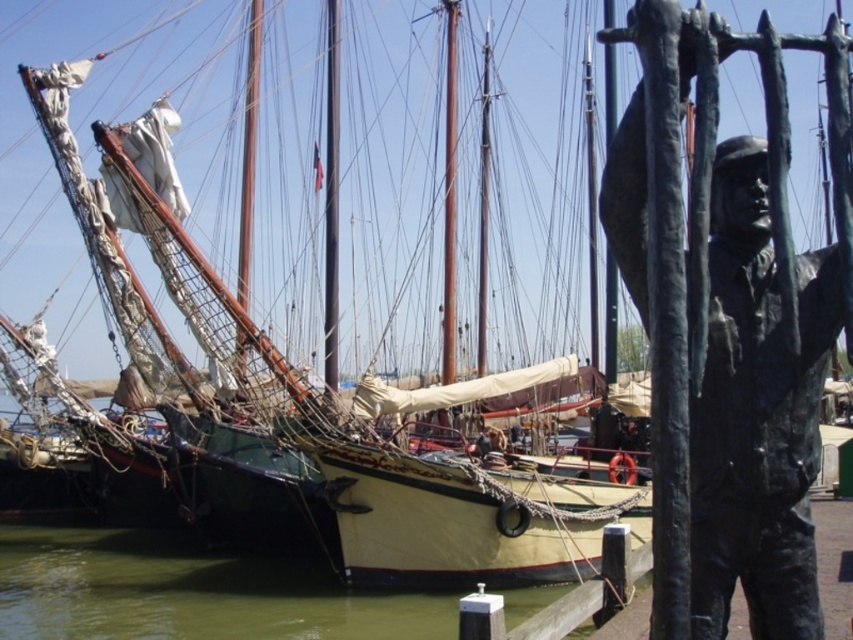
Question: Which of these objects is positioned closest to the green water at lower left?

Choices:
 (A) green matte sailboat at center
 (B) bronze statue at right

Answer: (A)

Question: Among these points, which one is nearest to the camera?

Choices:
 (A) (79, 564)
 (B) (767, 516)
 (C) (322, 538)

Answer: (B)

Question: Can you confirm if bronze statue at right is positioned to the right of green water at lower left?

Choices:
 (A) yes
 (B) no

Answer: (A)

Question: Can you confirm if green matte sailboat at center is positioned to the right of bronze statue at right?

Choices:
 (A) no
 (B) yes

Answer: (A)

Question: Is green matte sailboat at center wider than green water at lower left?

Choices:
 (A) yes
 (B) no

Answer: (A)

Question: Based on their relative distances, which object is nearer to the green matte sailboat at center?

Choices:
 (A) bronze statue at right
 (B) green water at lower left

Answer: (B)